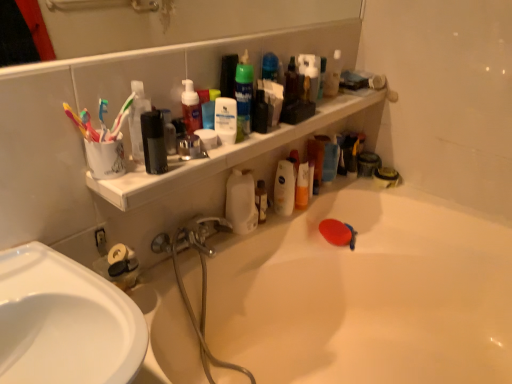
Question: Relative to multicolored plastic toothbrushes at left, the 2th toothbrush from the right, is white glossy bathtub at upper center in front or behind?

Choices:
 (A) behind
 (B) front

Answer: (B)

Question: Is white glossy bathtub at upper center to the left or to the right of multicolored plastic toothbrushes at left, the 2th toothbrush from the right, in the image?

Choices:
 (A) left
 (B) right

Answer: (B)

Question: Which object is the farthest from the matte red soap dispenser at upper center, which is the fifth cleaning product from right to left?

Choices:
 (A) translucent plastic spray bottle at upper center, the 5th cleaning product when ordered from front to back
 (B) white matte bottle at center, placed as the 4th cleaning product when sorted from front to back
 (C) white matte lotion at center, the second cleaning product when ordered from left to right
 (D) green matte shaving cream can at upper center, which ranks as the third cleaning product in front-to-back order
 (E) multicolored plastic toothbrushes at left, the 2th toothbrush from the right

Answer: (A)

Question: Considering the real-world distances, which object is farthest from the white matte bottle at center, which ranks as the 2th cleaning product in back-to-front order?

Choices:
 (A) green matte shaving cream can at upper center, which ranks as the third cleaning product in front-to-back order
 (B) white matte lotion at center, positioned as the fourth cleaning product in back-to-front order
 (C) silver metallic faucet at center
 (D) white glossy bathtub at upper center
 (E) translucent plastic spray bottle at upper center, placed as the 5th cleaning product when sorted from left to right

Answer: (E)